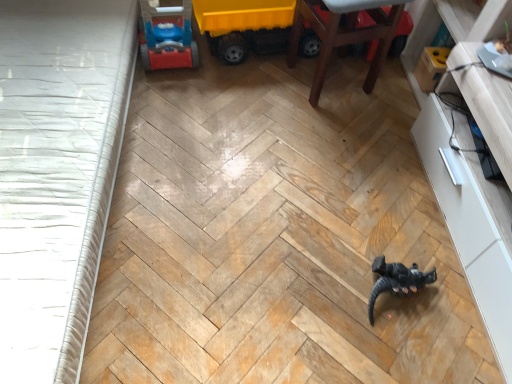
I want to click on vacant area that is situated to the right of wooden chair at upper right, so click(389, 94).